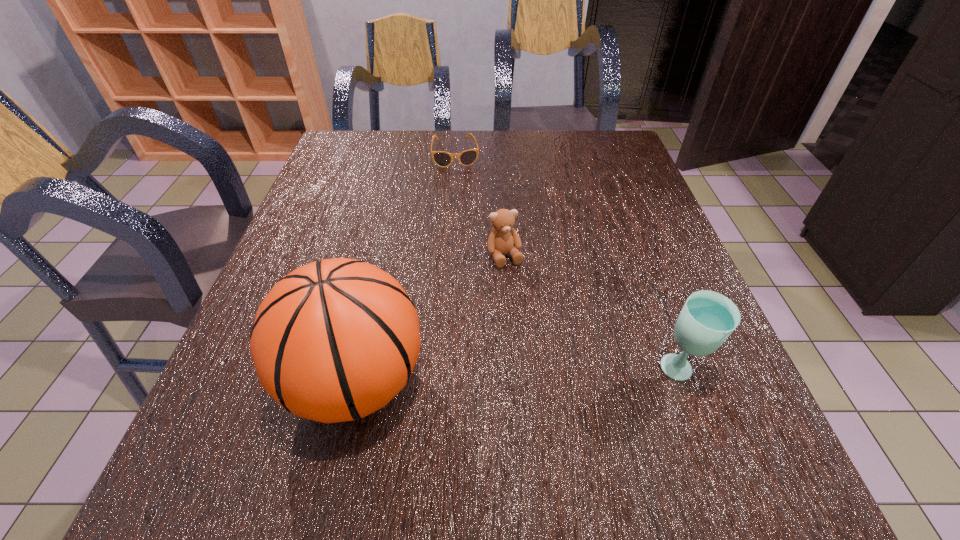
This screenshot has height=540, width=960. I want to click on vacant space that satisfies the following two spatial constraints: 1. on the back side of the basketball; 2. on the right side of the rightmost object, so click(x=358, y=372).

Locate an element on the screen. The width and height of the screenshot is (960, 540). free space that satisfies the following two spatial constraints: 1. on the back side of the rightmost object; 2. on the left side of the tallest object is located at coordinates (358, 372).